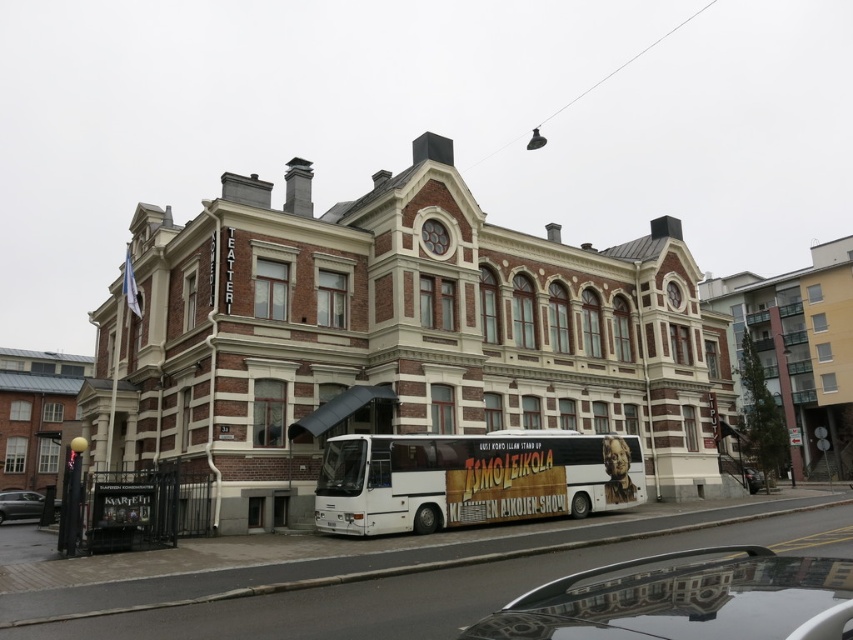
Which is more to the left, white matte bus at lower center or metallic silver car at lower left?

From the viewer's perspective, metallic silver car at lower left appears more on the left side.

Is the position of white matte bus at lower center more distant than that of metallic silver car at lower left?

No.

Image resolution: width=853 pixels, height=640 pixels. What do you see at coordinates (469, 480) in the screenshot?
I see `white matte bus at lower center` at bounding box center [469, 480].

At what (x,y) coordinates should I click in order to perform the action: click on white matte bus at lower center. Please return your answer as a coordinate pair (x, y). Looking at the image, I should click on (469, 480).

Is point (9, 512) positioned after point (751, 486)?

No.

Is metallic silver car at lower left thinner than shiny black car at lower right?

Incorrect, metallic silver car at lower left's width is not less than shiny black car at lower right's.

Is point (21, 508) positioned before point (746, 468)?

Yes, it is.

Identify the location of metallic silver car at lower left. (20, 506).

Can you confirm if silver metallic car at center is positioned to the left of metallic silver car at lower left?

Incorrect, silver metallic car at center is not on the left side of metallic silver car at lower left.

Looking at this image, is silver metallic car at center below metallic silver car at lower left?

Actually, silver metallic car at center is above metallic silver car at lower left.

Is point (770, 577) positioned in front of point (1, 522)?

That is True.

Identify the location of silver metallic car at center. Image resolution: width=853 pixels, height=640 pixels. (685, 600).